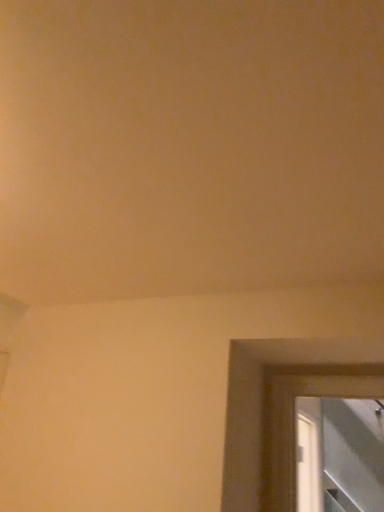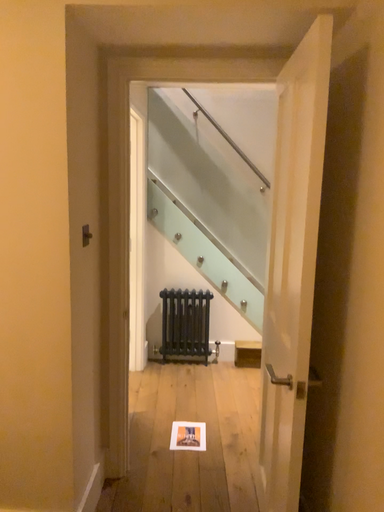
Question: How did the camera likely rotate when shooting the video?

Choices:
 (A) rotated left
 (B) rotated right

Answer: (B)